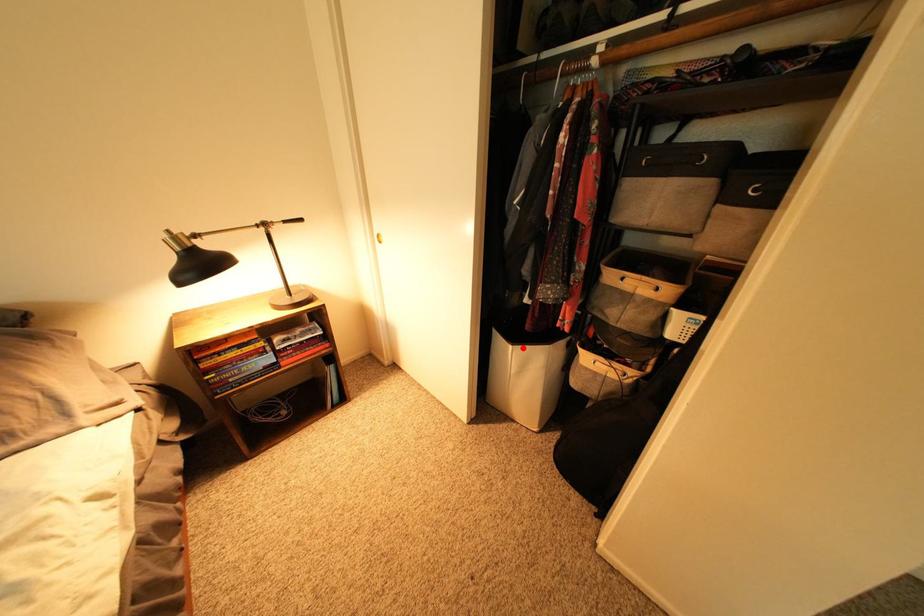
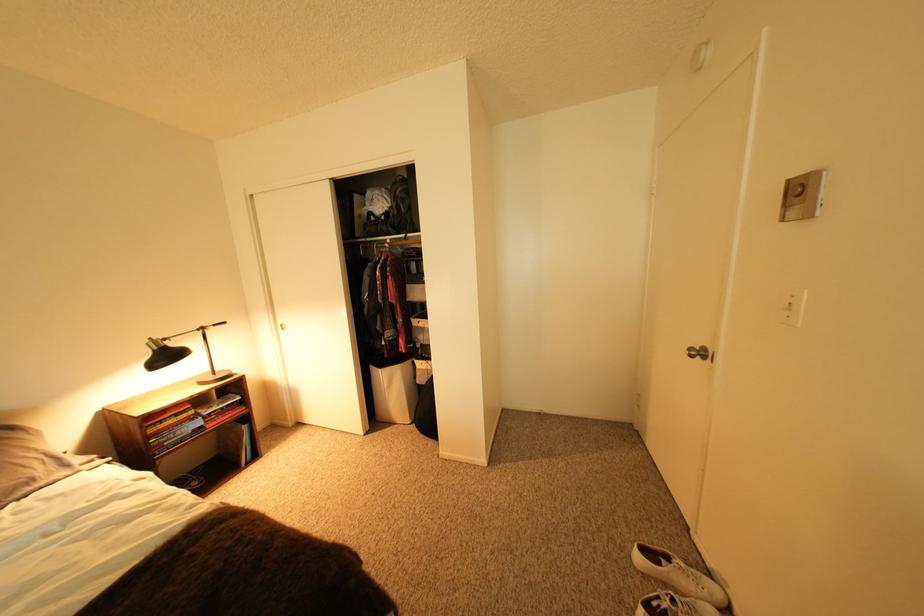
Question: I am providing you with two images of the same scene from different viewpoints. A red point is shown in image1. For the corresponding object point in image2, is it positioned nearer or farther from the camera?

Choices:
 (A) Nearer
 (B) Farther

Answer: (B)